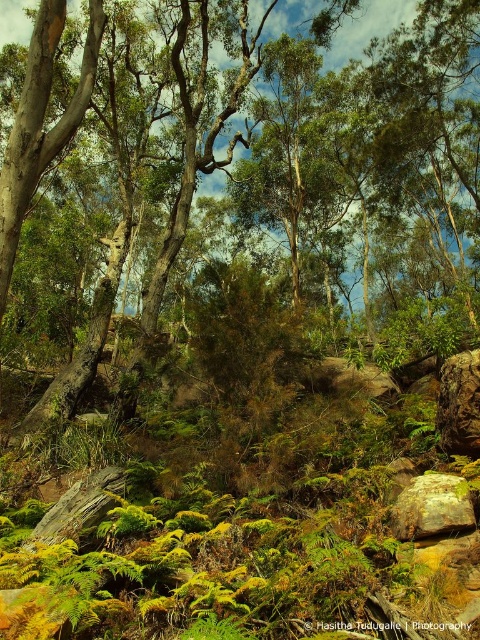
Question: Which point is closer to the camera?

Choices:
 (A) (370, 168)
 (B) (396, 532)

Answer: (B)

Question: Is green leafy tree at center bigger than rusty metallic rock at lower right?

Choices:
 (A) yes
 (B) no

Answer: (A)

Question: Is green leafy tree at center bigger than rusty metallic rock at lower right?

Choices:
 (A) no
 (B) yes

Answer: (B)

Question: Can you confirm if green leafy tree at center is positioned below rusty metallic rock at lower right?

Choices:
 (A) no
 (B) yes

Answer: (A)